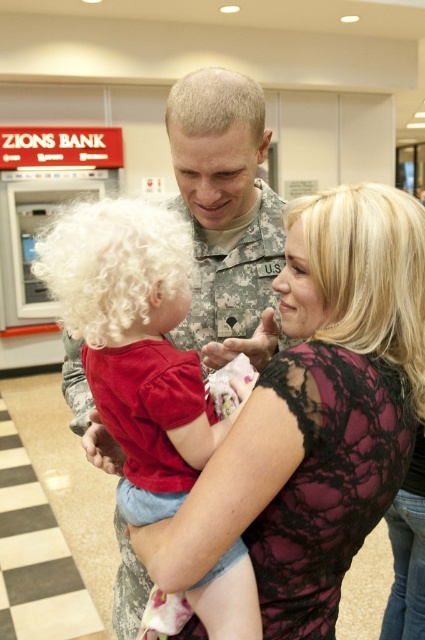
Question: Which of these objects is positioned closest to the lace fabric dress at center?

Choices:
 (A) curly white wig at left
 (B) blonde hair at center
 (C) blonde lace wig at upper right
 (D) soft white hair at center

Answer: (C)

Question: Considering the relative positions of curly white wig at left and blonde hair at center in the image provided, where is curly white wig at left located with respect to blonde hair at center?

Choices:
 (A) above
 (B) below

Answer: (B)

Question: Is blonde lace wig at upper right to the left of blonde hair at center from the viewer's perspective?

Choices:
 (A) yes
 (B) no

Answer: (B)

Question: Which point appears closest to the camera in this image?

Choices:
 (A) (289, 224)
 (B) (98, 278)
 (C) (314, 317)
 (D) (215, 88)

Answer: (B)

Question: Where is lace fabric dress at center located in relation to blonde hair at center in the image?

Choices:
 (A) below
 (B) above

Answer: (A)

Question: Which point is farther from the camera taking this photo?

Choices:
 (A) (370, 298)
 (B) (175, 256)
 (C) (138, 259)

Answer: (B)